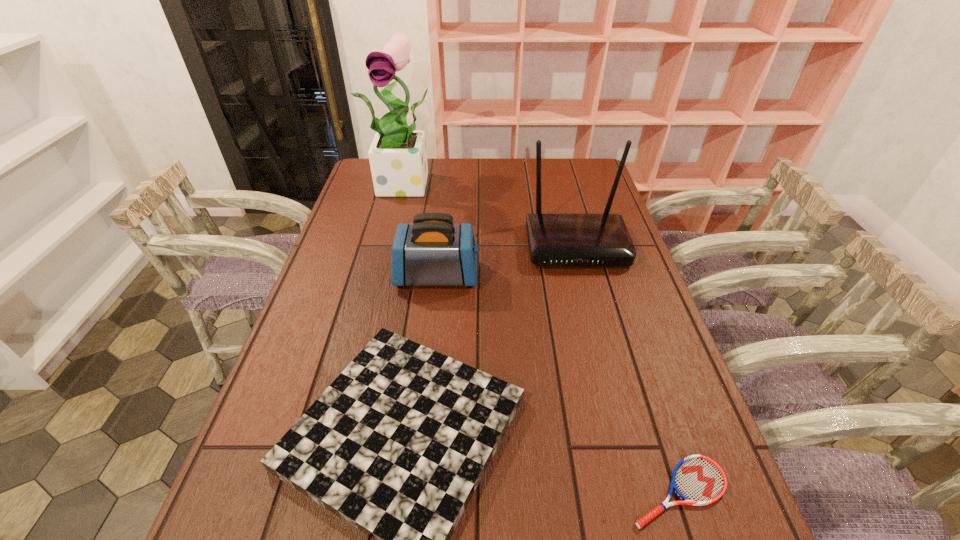
Find the location of `free space between the second tallest object and the tennis racket`. free space between the second tallest object and the tennis racket is located at coordinates (627, 369).

Locate an element on the screen. The image size is (960, 540). object that is the third closest to the flower arrangement is located at coordinates (396, 446).

At what (x,y) coordinates should I click in order to perform the action: click on object that ranks as the third closest to the tennis racket. Please return your answer as a coordinate pair (x, y). Looking at the image, I should click on (555, 240).

Identify the location of free space that satisfies the following two spatial constraints: 1. on the front-facing side of the tennis racket; 2. on the right side of the farthest object. This screenshot has width=960, height=540. (336, 492).

In order to click on vacant region that satisfies the following two spatial constraints: 1. on the front-facing side of the router; 2. on the front-facing side of the toaster in this screenshot , I will do `click(584, 276)`.

I want to click on free region that satisfies the following two spatial constraints: 1. on the front-facing side of the shortest object; 2. on the left side of the third tallest object, so click(x=414, y=492).